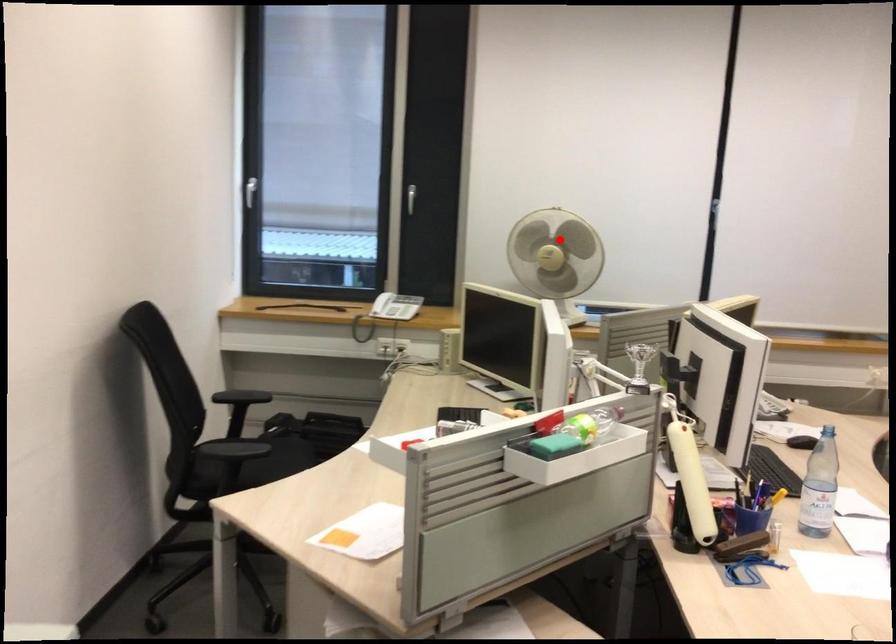
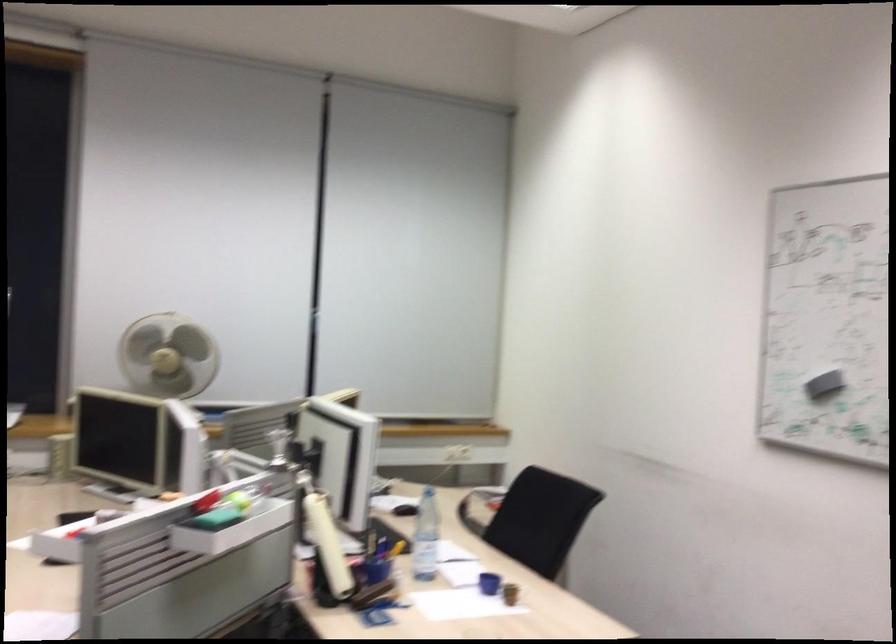
Where in the second image is the point corresponding to the highlighted location from the first image?

(168, 355)